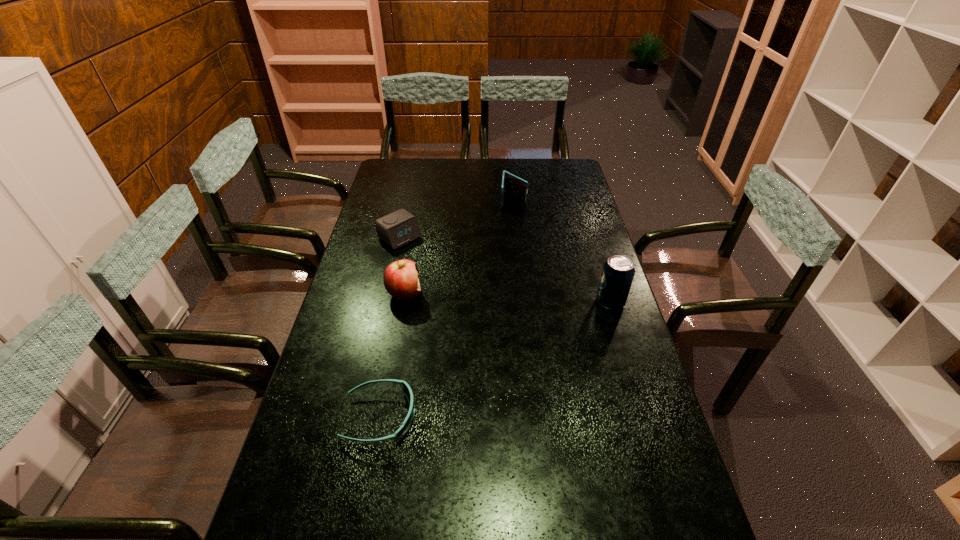
This screenshot has width=960, height=540. Find the location of `vacant space located on the front of the rightmost object`. vacant space located on the front of the rightmost object is located at coordinates (641, 404).

Find the location of a particular element. The width and height of the screenshot is (960, 540). vacant space located 0.140m on the exterior surface of the third shortest object is located at coordinates (512, 229).

This screenshot has width=960, height=540. In order to click on free space located on the exterior surface of the third shortest object in this screenshot , I will do `click(511, 240)`.

This screenshot has height=540, width=960. I want to click on free space located on the exterior surface of the third shortest object, so click(x=511, y=253).

Where is `vacant area situated 0.250m on the bitten side of the apple`? vacant area situated 0.250m on the bitten side of the apple is located at coordinates point(484,330).

Identify the location of free spot located on the bitten side of the apple. (504, 339).

This screenshot has width=960, height=540. In order to click on free space located on the bitten side of the apple in this screenshot , I will do `click(452, 315)`.

You are a GUI agent. You are given a task and a screenshot of the screen. Output one action in this format:
    pyautogui.click(x=<x>, y=<y>)
    Task: Click on the vacant space located 0.330m on the front-facing side of the fourth tallest object
    The height and width of the screenshot is (540, 960).
    Given the screenshot: What is the action you would take?
    pyautogui.click(x=470, y=292)

The width and height of the screenshot is (960, 540). I want to click on free spot located on the front-facing side of the fourth tallest object, so click(x=465, y=287).

Identify the location of free space located on the front-facing side of the fourth tallest object. (467, 289).